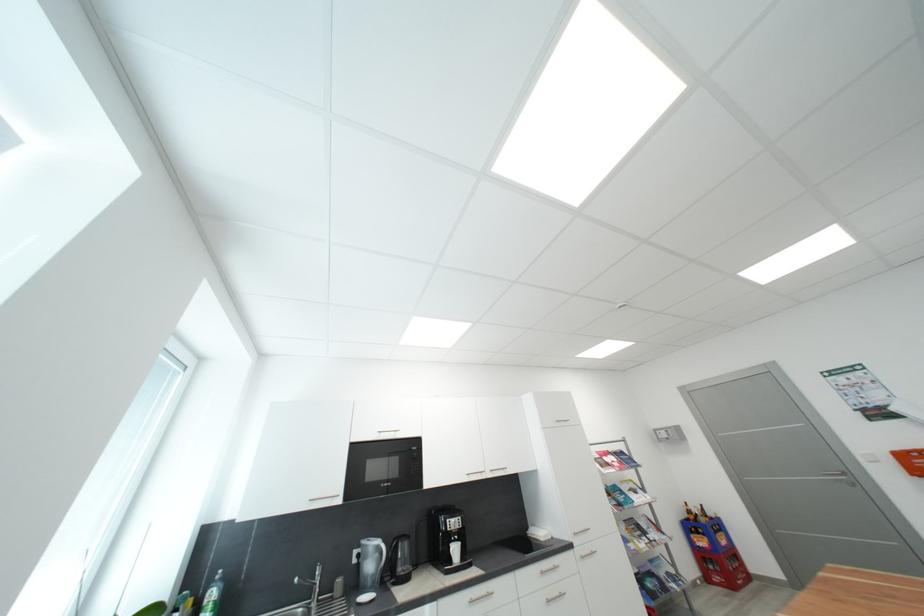
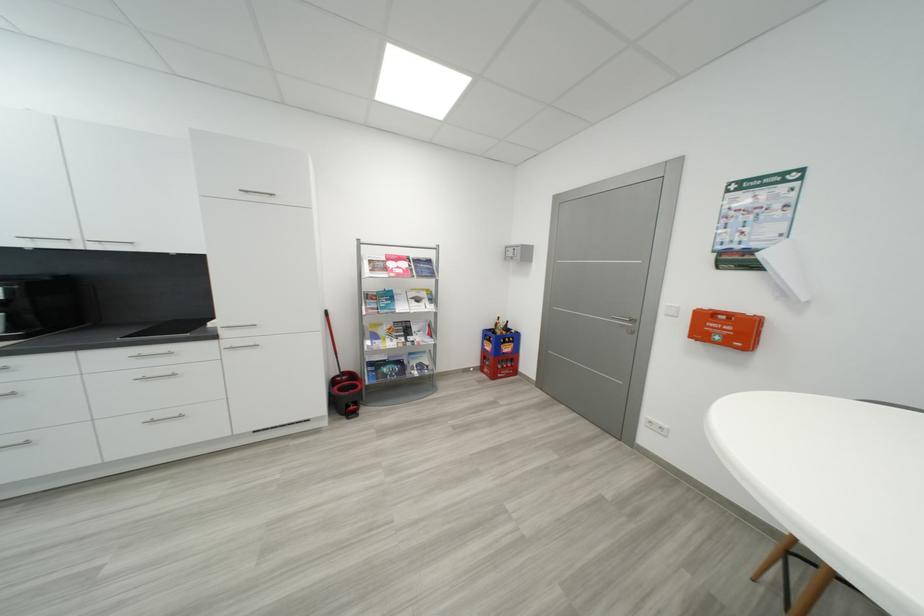
Find the pixel in the second image that matches point 852,475 in the first image.

(639, 322)